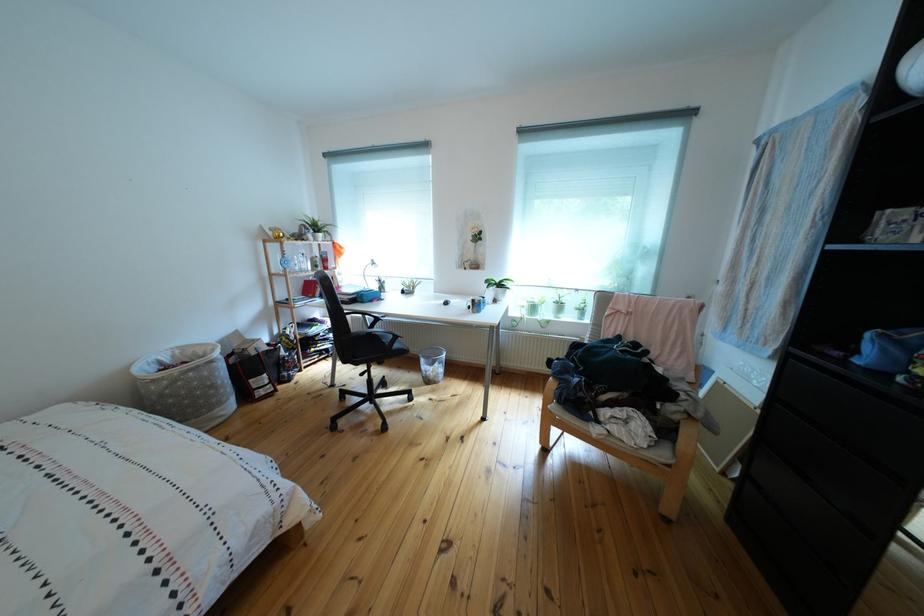
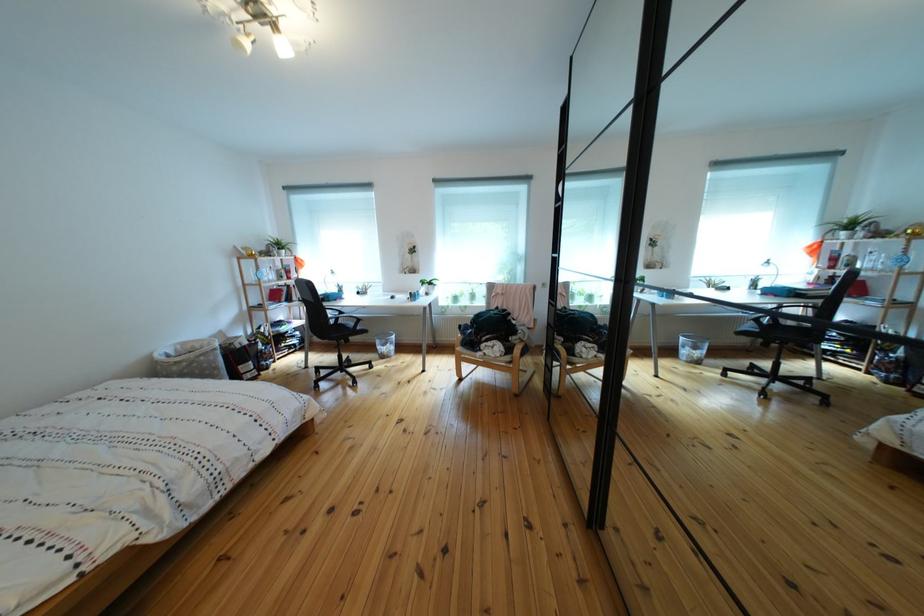
The point at (312, 277) is marked in the first image. Where is the corresponding point in the second image?

(282, 286)